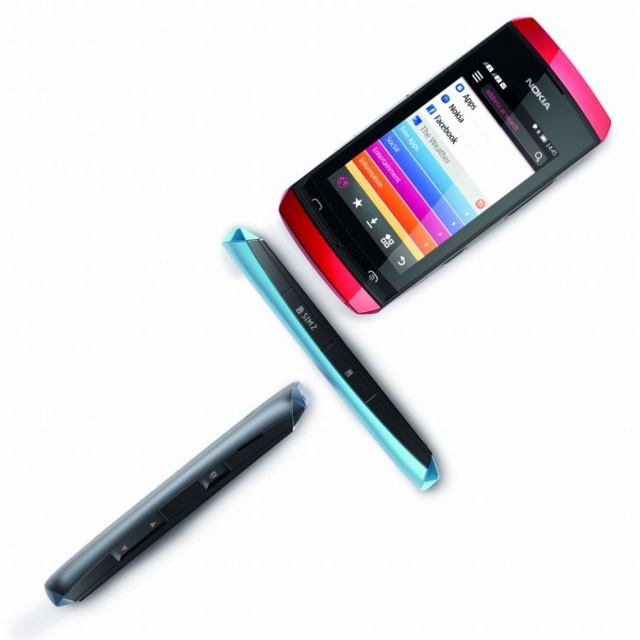
You are taking a photo of the Nokia smartphone and the two stylus pens. You want to focus on the point closer to the camera between the two points labeled as point (298, 403) and point (417, 481). Which point should you focus on?

You should focus on point (298, 403) because it is closer to the camera than point (417, 481).

You are trying to place the pink glossy smartphone at upper center and the black glossy pen at center into a rectangular case that can only fit one of them. Based on their widths, which object would you choose to place in the case?

The pink glossy smartphone at upper center might be wider than black glossy pen at center, so it is possible that the smartphone would not fit into the case designed for the pen. Therefore, the black glossy pen at center is more likely to fit.

You are holding a pink glossy smartphone at upper center and a black glossy pen at center. Which object is larger in size?

The pink glossy smartphone at upper center is bigger than the black glossy pen at center.